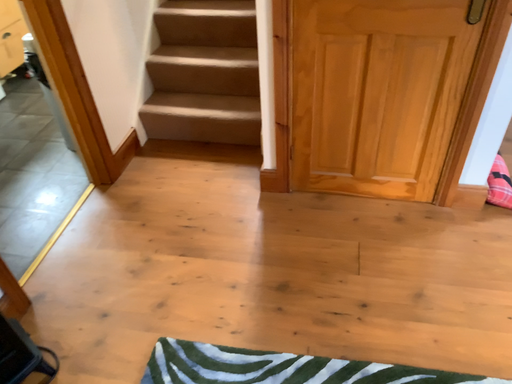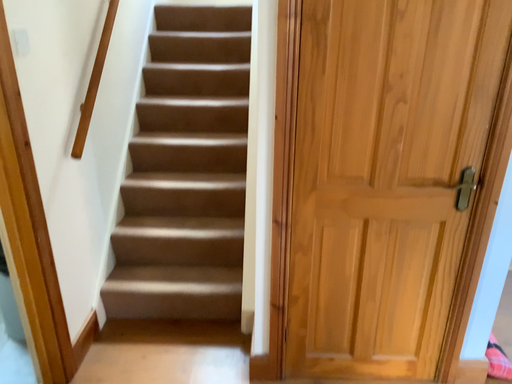
Question: How did the camera likely rotate when shooting the video?

Choices:
 (A) rotated left
 (B) rotated right

Answer: (B)